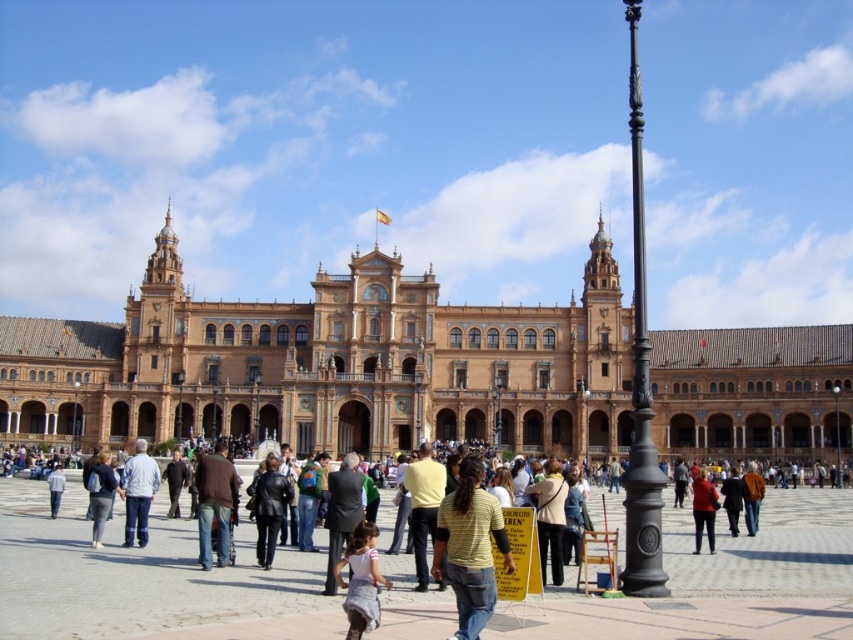
You are a photographer at the plaza and want to capture both the light brown fabric dress at center and the light blue jeans at center in a single frame. Which of the two objects should you focus on first to ensure they both fit in the shot?

Since the light brown fabric dress at center is not as tall as light blue jeans at center, you should focus on the taller light blue jeans at center first to ensure both fit in the shot.

You are standing in the plaza and see a light brown fabric dress at center and a light blue jeans at center. Which one is nearer to you?

The light brown fabric dress at center is closer to the viewer than the light blue jeans at center.

You are a fashion designer observing people in the plaza. You notice a person wearing a brown leather jacket at center and light blue jeans at center. Which clothing item is taller?

The brown leather jacket at center is taller than the light blue jeans at center.